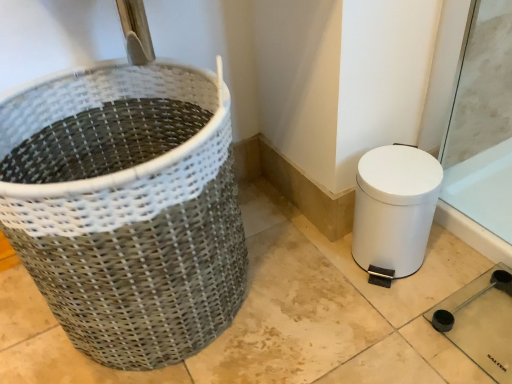
Question: From a real-world perspective, is white matte toilet bowl at lower right located higher than natural woven basket at left?

Choices:
 (A) yes
 (B) no

Answer: (B)

Question: Can you confirm if white matte toilet bowl at lower right is thinner than natural woven basket at left?

Choices:
 (A) yes
 (B) no

Answer: (A)

Question: Can we say white matte toilet bowl at lower right lies outside natural woven basket at left?

Choices:
 (A) no
 (B) yes

Answer: (B)

Question: Is natural woven basket at left completely or partially inside white matte toilet bowl at lower right?

Choices:
 (A) yes
 (B) no

Answer: (B)

Question: Is the depth of white matte toilet bowl at lower right greater than that of natural woven basket at left?

Choices:
 (A) yes
 (B) no

Answer: (A)

Question: Would you consider white matte toilet bowl at lower right to be distant from natural woven basket at left?

Choices:
 (A) no
 (B) yes

Answer: (A)

Question: Are natural woven basket at left and white matte toilet bowl at lower right beside each other?

Choices:
 (A) no
 (B) yes

Answer: (A)

Question: Considering the relative sizes of natural woven basket at left and white matte toilet bowl at lower right in the image provided, is natural woven basket at left wider than white matte toilet bowl at lower right?

Choices:
 (A) no
 (B) yes

Answer: (B)

Question: Is natural woven basket at left not inside white matte toilet bowl at lower right?

Choices:
 (A) yes
 (B) no

Answer: (A)

Question: From a real-world perspective, does natural woven basket at left sit lower than white matte toilet bowl at lower right?

Choices:
 (A) no
 (B) yes

Answer: (A)

Question: From the image's perspective, is natural woven basket at left under white matte toilet bowl at lower right?

Choices:
 (A) no
 (B) yes

Answer: (A)

Question: Is white matte toilet bowl at lower right a part of natural woven basket at left?

Choices:
 (A) yes
 (B) no

Answer: (B)

Question: From a real-world perspective, is white matte toilet bowl at lower right above or below natural woven basket at left?

Choices:
 (A) below
 (B) above

Answer: (A)